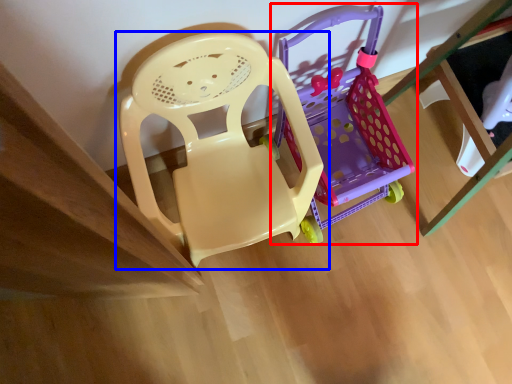
Question: Among these objects, which one is nearest to the camera, toy (highlighted by a red box) or chair (highlighted by a blue box)?

Choices:
 (A) toy
 (B) chair

Answer: (B)